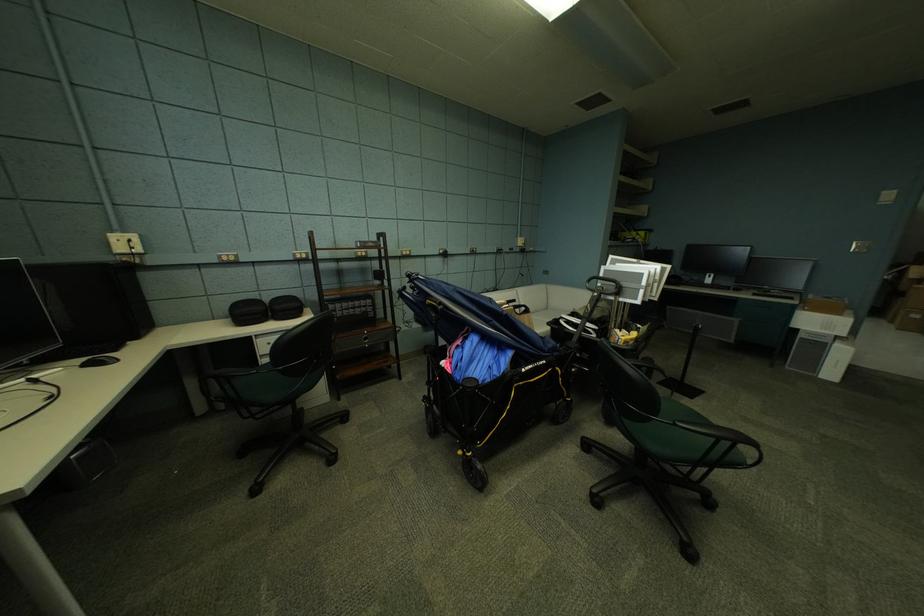
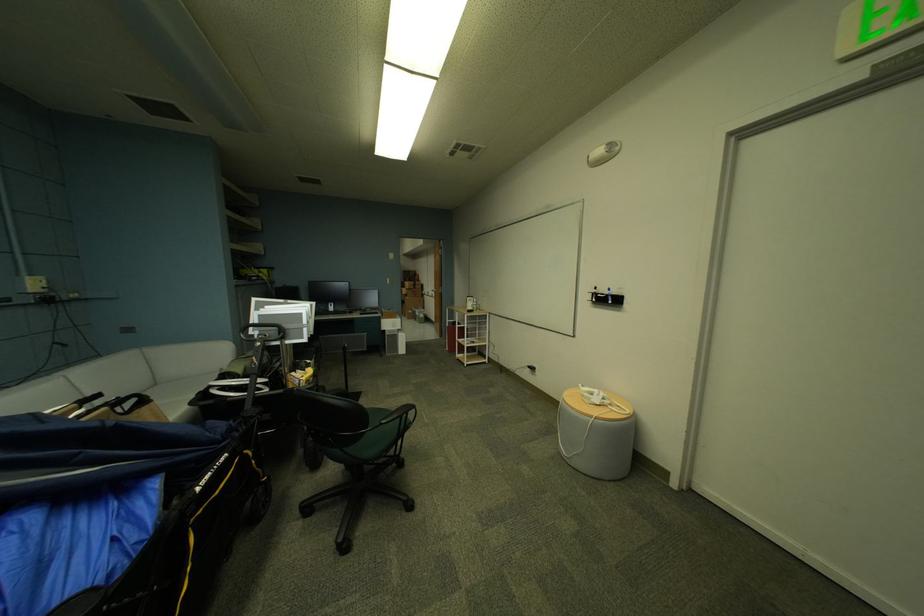
Locate, in the second image, the point that corresponds to (x=735, y=445) in the first image.

(414, 418)